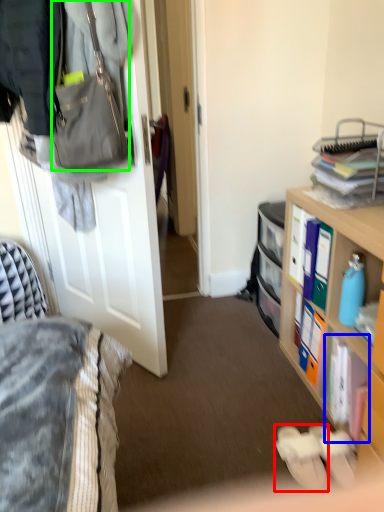
Question: Which object is positioned farthest from footwear (highlighted by a red box)? Select from book (highlighted by a blue box) and handbag (highlighted by a green box).

Choices:
 (A) book
 (B) handbag

Answer: (B)